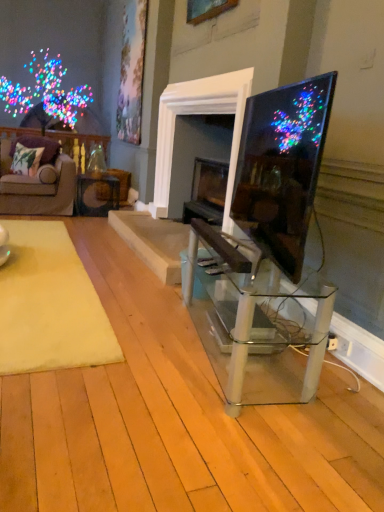
Based on the photo, what is the approximate height of green floral fabric pillow at left?

green floral fabric pillow at left is 14.14 inches tall.

What do you see at coordinates (50, 304) in the screenshot? I see `yellow plush rug at lower left` at bounding box center [50, 304].

This screenshot has height=512, width=384. Describe the element at coordinates (257, 323) in the screenshot. I see `clear glass table at center, the 2th table from the top` at that location.

Find the location of `green floral fabric pillow at left`. green floral fabric pillow at left is located at coordinates (26, 160).

Considering the sizes of objects matte black tv at right and yellow plush rug at lower left in the image provided, who is wider, matte black tv at right or yellow plush rug at lower left?

Wider between the two is yellow plush rug at lower left.

Does matte black tv at right come behind yellow plush rug at lower left?

No, it is in front of yellow plush rug at lower left.

From the image's perspective, is matte black tv at right above yellow plush rug at lower left?

Indeed, from the image's perspective, matte black tv at right is shown above yellow plush rug at lower left.

Are matte black tv at right and yellow plush rug at lower left far apart?

Indeed, matte black tv at right is not near yellow plush rug at lower left.

Considering the positions of objects green floral fabric pillow at left and velvet purple couch at left in the image provided, who is more to the left, green floral fabric pillow at left or velvet purple couch at left?

green floral fabric pillow at left is more to the left.

Considering the relative sizes of green floral fabric pillow at left and velvet purple couch at left in the image provided, is green floral fabric pillow at left taller than velvet purple couch at left?

Incorrect, the height of green floral fabric pillow at left is not larger of that of velvet purple couch at left.

Where is `studio couch that is under the green floral fabric pillow at left (from a real-world perspective)`? studio couch that is under the green floral fabric pillow at left (from a real-world perspective) is located at coordinates (40, 190).

Is matte black table at center, placed as the 1th table when sorted from back to front, oriented away from green floral fabric pillow at left?

No, matte black table at center, placed as the 1th table when sorted from back to front, is not facing the opposite direction of green floral fabric pillow at left.

How distant is matte black table at center, placed as the 1th table when sorted from back to front, from green floral fabric pillow at left?

They are 28.25 inches apart.

Looking at this image, can you confirm if matte black table at center, which is the 2th table from bottom to top, is positioned to the left of green floral fabric pillow at left?

In fact, matte black table at center, which is the 2th table from bottom to top, is to the right of green floral fabric pillow at left.

Is matte black table at center, which is the 2th table from bottom to top, behind green floral fabric pillow at left?

Yes, matte black table at center, which is the 2th table from bottom to top, is further from the camera.

Is clear glass table at center, positioned as the first table in front-to-back order, wider or thinner than yellow plush rug at lower left?

Clearly, clear glass table at center, positioned as the first table in front-to-back order, has less width compared to yellow plush rug at lower left.

Considering the positions of objects clear glass table at center, acting as the second table starting from the left, and yellow plush rug at lower left in the image provided, who is behind, clear glass table at center, acting as the second table starting from the left, or yellow plush rug at lower left?

yellow plush rug at lower left.

From the image's perspective, is clear glass table at center, the 2th table from the top, above or below yellow plush rug at lower left?

clear glass table at center, the 2th table from the top, is below yellow plush rug at lower left.

From a real-world perspective, is clear glass table at center, acting as the second table starting from the left, beneath yellow plush rug at lower left?

No.

Is point (297, 187) more distant than point (311, 278)?

No.

Consider the image. Is matte black tv at right situated inside clear glass table at center, positioned as the first table in front-to-back order, or outside?

matte black tv at right cannot be found inside clear glass table at center, positioned as the first table in front-to-back order.

Could you tell me if matte black tv at right is turned towards clear glass table at center, acting as the second table starting from the left?

No, matte black tv at right is not facing towards clear glass table at center, acting as the second table starting from the left.

From a real-world perspective, is matte black tv at right physically located above or below clear glass table at center, positioned as the first table in front-to-back order?

From a real-world perspective, matte black tv at right is physically above clear glass table at center, positioned as the first table in front-to-back order.

Looking at this image, relative to velvet purple couch at left, is yellow plush rug at lower left in front or behind?

yellow plush rug at lower left is in front of velvet purple couch at left.

Is yellow plush rug at lower left positioned beyond the bounds of velvet purple couch at left?

Indeed, yellow plush rug at lower left is completely outside velvet purple couch at left.

Does yellow plush rug at lower left have a lesser height compared to velvet purple couch at left?

Correct, yellow plush rug at lower left is not as tall as velvet purple couch at left.

Which is behind, point (7, 174) or point (318, 149)?

Point (7, 174)

Considering the relative positions of velvet purple couch at left and matte black tv at right in the image provided, is velvet purple couch at left to the left of matte black tv at right from the viewer's perspective?

Indeed, velvet purple couch at left is positioned on the left side of matte black tv at right.

From the image's perspective, which one is positioned lower, velvet purple couch at left or matte black tv at right?

matte black tv at right appears lower in the image.

Would you consider velvet purple couch at left to be distant from matte black tv at right?

Yes, velvet purple couch at left is far from matte black tv at right.

What are the coordinates of `television above the yellow plush rug at lower left (from the image's perspective)` in the screenshot? It's located at (282, 168).

Identify the location of pillow on the left of velvet purple couch at left. The height and width of the screenshot is (512, 384). pyautogui.click(x=26, y=160).

Based on their spatial positions, is matte black table at center, the first table from the left, or velvet purple couch at left further from clear glass table at center, placed as the first table when sorted from bottom to top?

matte black table at center, the first table from the left, is positioned further to the anchor clear glass table at center, placed as the first table when sorted from bottom to top.

Estimate the real-world distances between objects in this image. Which object is further from yellow plush rug at lower left, velvet purple couch at left or matte black table at center, placed as the 1th table when sorted from top to bottom?

The object further to yellow plush rug at lower left is matte black table at center, placed as the 1th table when sorted from top to bottom.

In the scene shown: Looking at the image, which one is located closer to velvet purple couch at left, matte black tv at right or green floral fabric pillow at left?

green floral fabric pillow at left lies closer to velvet purple couch at left than the other object.

Considering their positions, is velvet purple couch at left positioned further to yellow plush rug at lower left than matte black tv at right?

velvet purple couch at left is further to yellow plush rug at lower left.

Based on their spatial positions, is yellow plush rug at lower left or matte black tv at right further from green floral fabric pillow at left?

matte black tv at right.

Estimate the real-world distances between objects in this image. Which object is further from velvet purple couch at left, clear glass table at center, placed as the first table when sorted from bottom to top, or green floral fabric pillow at left?

clear glass table at center, placed as the first table when sorted from bottom to top, is further to velvet purple couch at left.

From the image, which object appears to be farther from clear glass table at center, placed as the first table when sorted from bottom to top, velvet purple couch at left or matte black tv at right?

Among the two, velvet purple couch at left is located further to clear glass table at center, placed as the first table when sorted from bottom to top.

Considering their positions, is matte black tv at right positioned further to matte black table at center, acting as the second table starting from the right, than clear glass table at center, acting as the first table starting from the right?

matte black tv at right.

At what (x,y) coordinates should I click in order to perform the action: click on mat located between matte black tv at right and green floral fabric pillow at left in the depth direction. Please return your answer as a coordinate pair (x, y). The image size is (384, 512). Looking at the image, I should click on (50, 304).

Where is `pillow between yellow plush rug at lower left and matte black table at center, acting as the second table starting from the right, along the z-axis`? pillow between yellow plush rug at lower left and matte black table at center, acting as the second table starting from the right, along the z-axis is located at coordinates (26, 160).

Locate an element on the screen. Image resolution: width=384 pixels, height=512 pixels. table positioned between matte black tv at right and velvet purple couch at left from near to far is located at coordinates (257, 323).

Identify the location of table between matte black tv at right and matte black table at center, which is the 2th table from bottom to top, in the front-back direction. Image resolution: width=384 pixels, height=512 pixels. (257, 323).